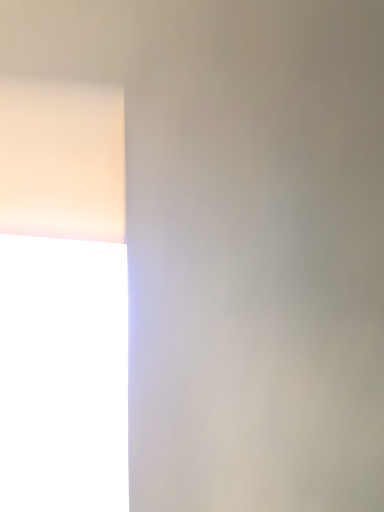
Describe the element at coordinates (63, 298) in the screenshot. I see `white glossy window at left` at that location.

Locate an element on the screen. white glossy window at left is located at coordinates (63, 298).

Find the location of a particular element. This screenshot has height=512, width=384. white glossy window at left is located at coordinates (63, 298).